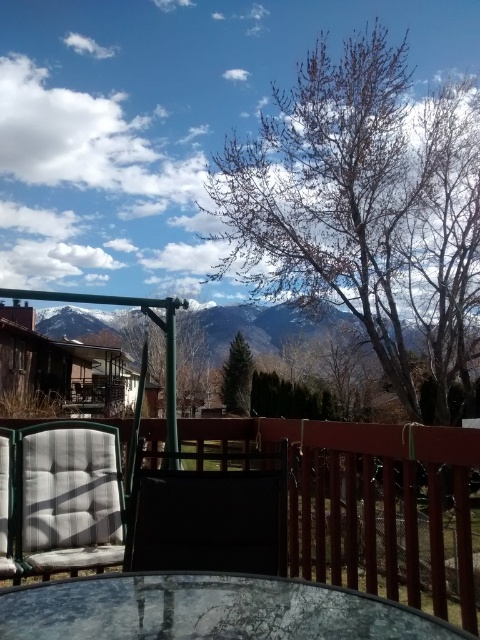
Question: Which object appears farthest from the camera in this image?

Choices:
 (A) transparent glass table at center
 (B) gray fabric cushion at left
 (C) matte black armchair at center

Answer: (B)

Question: Can you confirm if green metal swing at center is positioned to the left of gray fabric cushion at left?

Choices:
 (A) yes
 (B) no

Answer: (B)

Question: Considering the real-world distances, which object is closest to the matte black armchair at center?

Choices:
 (A) green metal swing at center
 (B) transparent glass table at center
 (C) gray fabric cushion at left
 (D) matte gray cushion at lower left

Answer: (A)

Question: Estimate the real-world distances between objects in this image. Which object is closer to the transparent glass table at center?

Choices:
 (A) matte gray cushion at lower left
 (B) green metal swing at center

Answer: (B)

Question: Can you confirm if transparent glass table at center is positioned above matte black armchair at center?

Choices:
 (A) no
 (B) yes

Answer: (A)

Question: Is transparent glass table at center further to camera compared to matte black armchair at center?

Choices:
 (A) no
 (B) yes

Answer: (A)